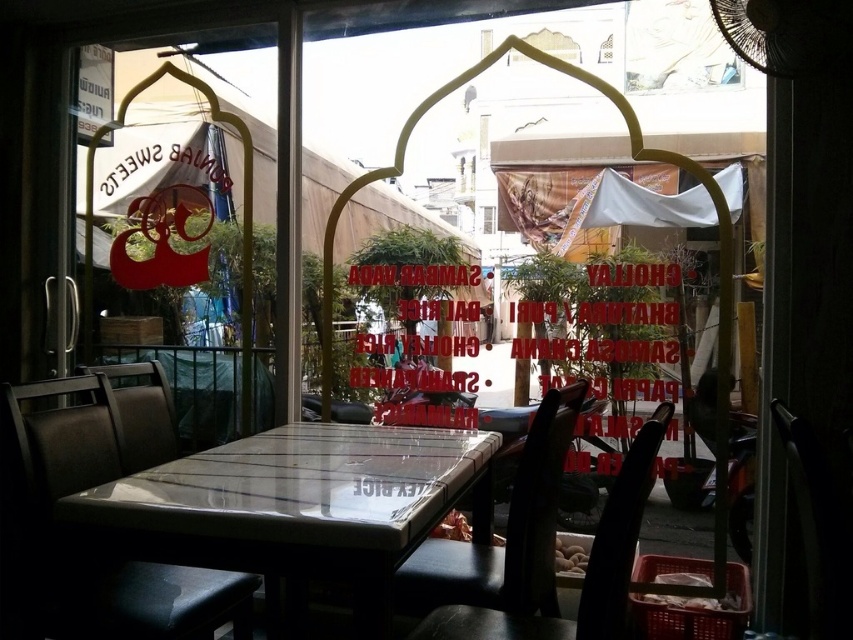
Question: Which of these objects is positioned closest to the dark brown leather chair at center?

Choices:
 (A) matte glass table at center
 (B) transparent glass sign at upper left

Answer: (A)

Question: Which object is the closest to the transparent glass window at center?

Choices:
 (A) matte glass table at center
 (B) matte black chair at center

Answer: (A)

Question: Is black leather chair at lower center thinner than transparent glass window at center?

Choices:
 (A) no
 (B) yes

Answer: (A)

Question: Does matte glass table at center have a larger size compared to transparent glass window at center?

Choices:
 (A) no
 (B) yes

Answer: (B)

Question: Considering the real-world distances, which object is closest to the matte black chair at center?

Choices:
 (A) transparent glass window at center
 (B) dark brown leather chair at center

Answer: (B)

Question: Is matte glass table at center to the left of matte black chair at center from the viewer's perspective?

Choices:
 (A) yes
 (B) no

Answer: (B)